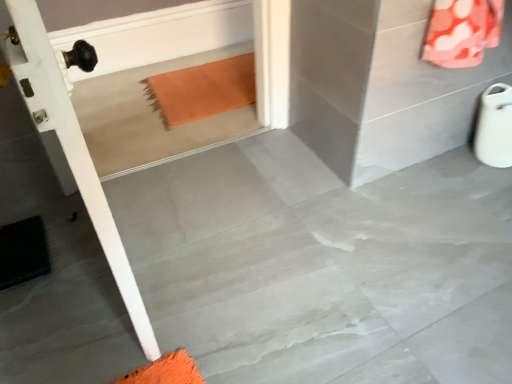
Question: Is orange fabric at upper right shorter than black rubber doormat at lower left?

Choices:
 (A) yes
 (B) no

Answer: (B)

Question: Is orange fabric at upper right thinner than black rubber doormat at lower left?

Choices:
 (A) no
 (B) yes

Answer: (B)

Question: Does orange fabric at upper right have a smaller size compared to black rubber doormat at lower left?

Choices:
 (A) no
 (B) yes

Answer: (A)

Question: Is orange fabric at upper right aimed at black rubber doormat at lower left?

Choices:
 (A) yes
 (B) no

Answer: (A)

Question: From the image's perspective, does orange fabric at upper right appear lower than black rubber doormat at lower left?

Choices:
 (A) yes
 (B) no

Answer: (B)

Question: Is orange fabric at upper right to the right of black rubber doormat at lower left from the viewer's perspective?

Choices:
 (A) no
 (B) yes

Answer: (B)

Question: From the image's perspective, would you say black rubber doormat at lower left is shown under gray polished concrete at center?

Choices:
 (A) no
 (B) yes

Answer: (B)

Question: Is black rubber doormat at lower left to the right of gray polished concrete at center from the viewer's perspective?

Choices:
 (A) no
 (B) yes

Answer: (A)

Question: Is black rubber doormat at lower left not close to gray polished concrete at center?

Choices:
 (A) yes
 (B) no

Answer: (B)

Question: Can you confirm if black rubber doormat at lower left is smaller than gray polished concrete at center?

Choices:
 (A) yes
 (B) no

Answer: (A)

Question: Considering the relative sizes of black rubber doormat at lower left and gray polished concrete at center in the image provided, is black rubber doormat at lower left thinner than gray polished concrete at center?

Choices:
 (A) no
 (B) yes

Answer: (B)

Question: Does black rubber doormat at lower left have a lesser height compared to gray polished concrete at center?

Choices:
 (A) no
 (B) yes

Answer: (A)

Question: Are gray polished concrete at center and orange fabric at upper right beside each other?

Choices:
 (A) yes
 (B) no

Answer: (B)